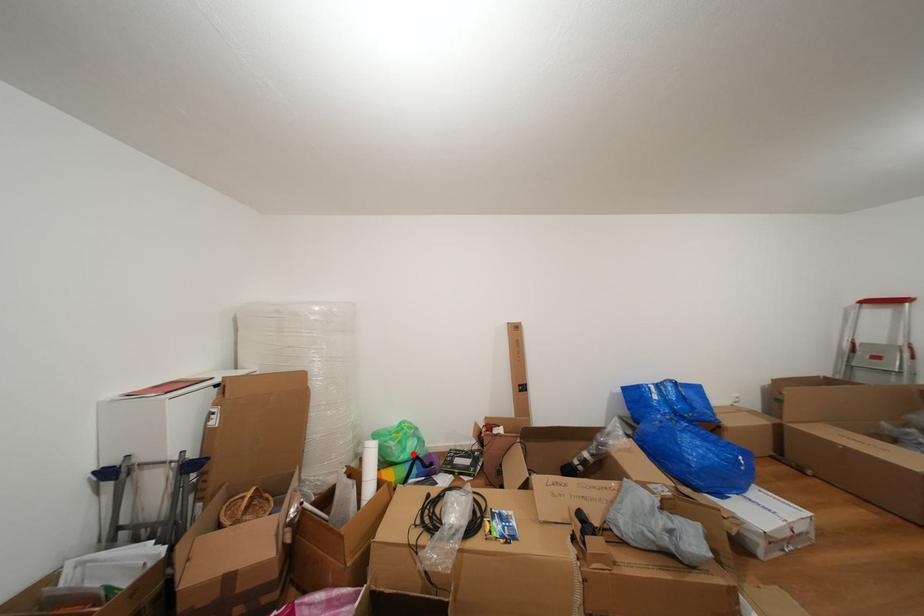
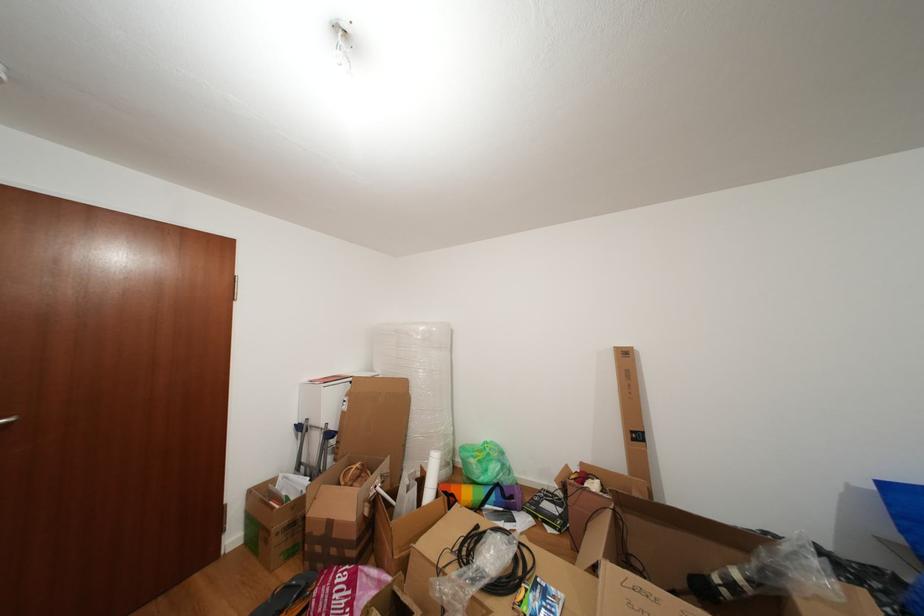
Question: I am providing you with two images of the same scene from different viewpoints. Image1 has a red point marked. In image2, the corresponding 3D location appears at what relative position? Reply with the corresponding letter.

Choices:
 (A) Closer
 (B) Farther

Answer: (B)